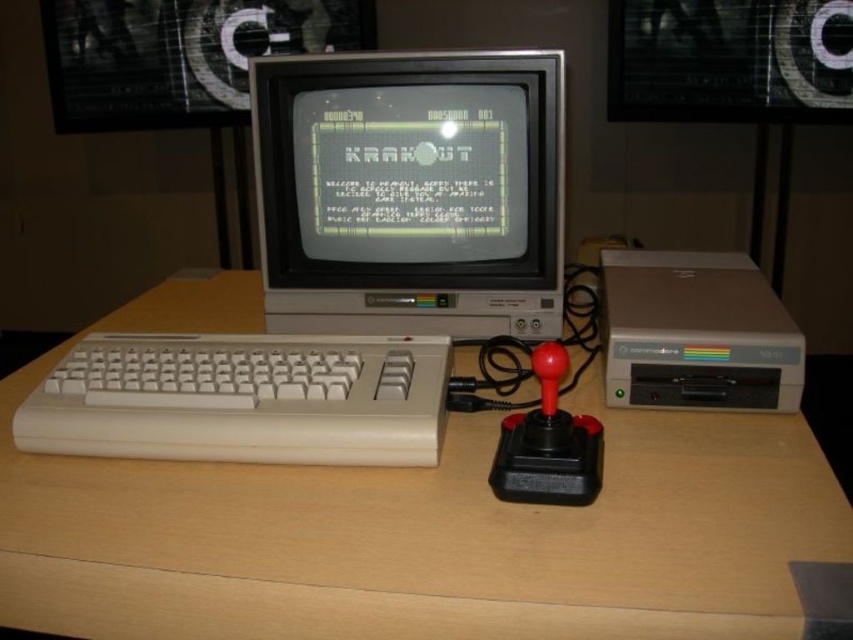
You are organizing a retro gaming exhibit and need to place a label next to the white plastic keyboard at lower left. Since the label is 10 cm wide, will it fit on the light brown wood at center without overlapping the keyboard?

The light brown wood at center is larger in size than the white plastic keyboard at lower left, so the label can be placed on the light brown wood at center without overlapping the keyboard.

You are sitting at the desk and want to reach the light brown wood at center to place a coffee mug. However, there is a white plastic keyboard at lower left in the way. Can you move the keyboard to access the wood surface?

The light brown wood at center is in front of the white plastic keyboard at lower left, meaning the keyboard is behind the wood surface. Therefore, you don not need to move the keyboard to access the wood surface.

You are a photographer trying to capture the vintage computer setup. You notice two points on the monitor screen, one at coordinates point (749, 554) and another at point (318, 360). Which point will appear larger in your photo?

Point (749, 554) is closer to the camera than point (318, 360), so it will appear larger in the photo.